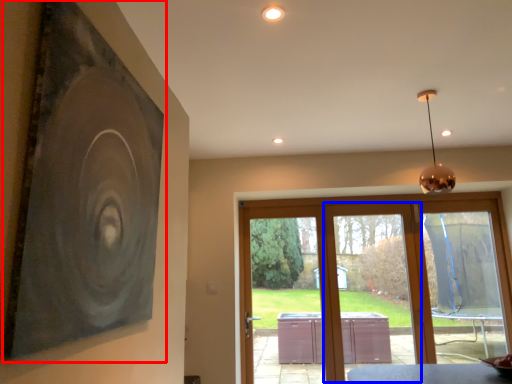
Question: Which point is closer to the camera, picture frame (highlighted by a red box) or screen door (highlighted by a blue box)?

Choices:
 (A) picture frame
 (B) screen door

Answer: (A)